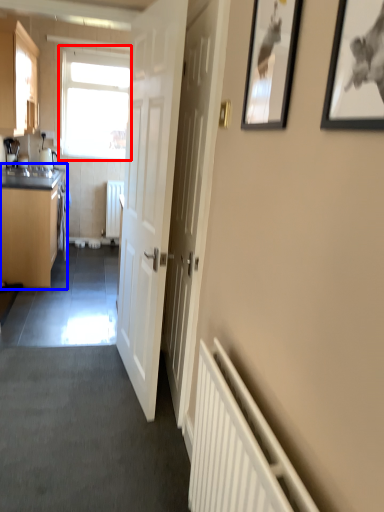
Question: Among these objects, which one is farthest to the camera, window (highlighted by a red box) or cabinetry (highlighted by a blue box)?

Choices:
 (A) window
 (B) cabinetry

Answer: (A)